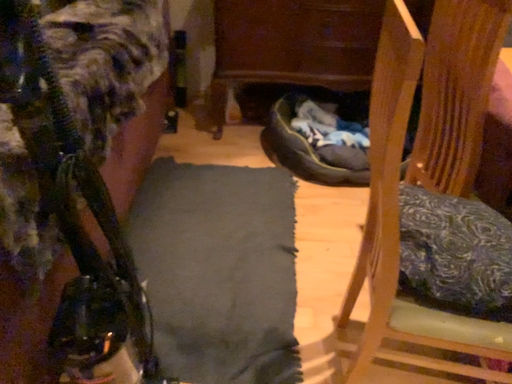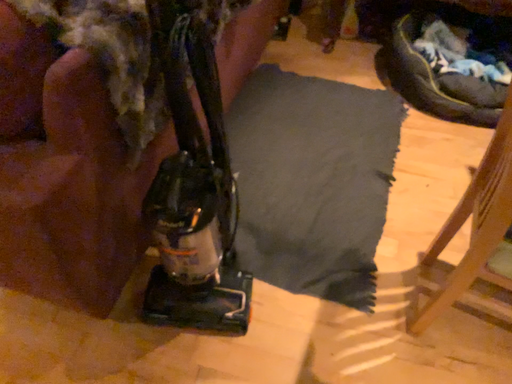
Question: How did the camera likely rotate when shooting the video?

Choices:
 (A) rotated right
 (B) rotated left

Answer: (B)